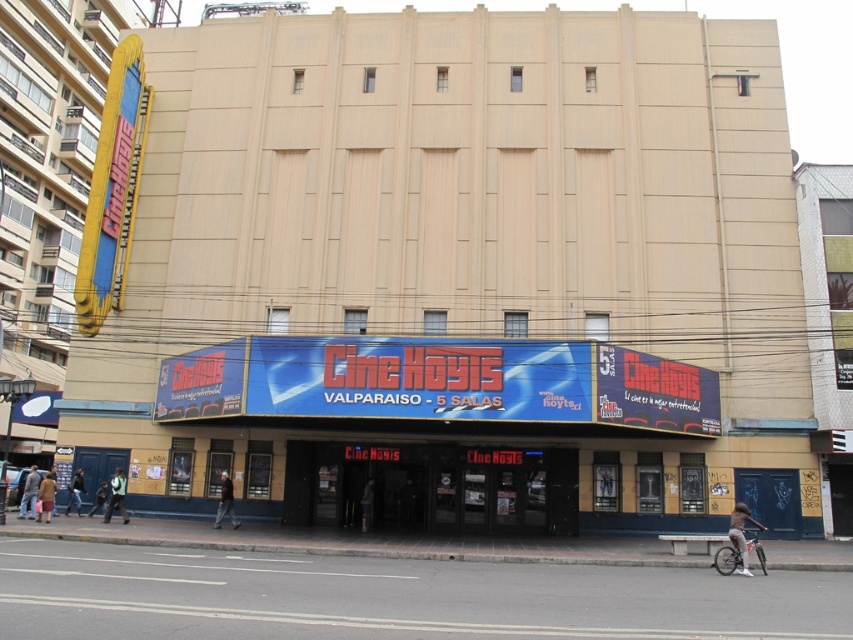
Question: Which object is closer to the camera taking this photo?

Choices:
 (A) dark gray fabric pants at center
 (B) light brown leather jacket at lower left
 (C) green fabric jacket at lower left
 (D) gray fabric jacket at lower right

Answer: (D)

Question: Does light brown leather jacket at lower left appear on the right side of dark brown leather jacket at lower left?

Choices:
 (A) yes
 (B) no

Answer: (B)

Question: Can you confirm if green fabric jacket at lower left is positioned to the right of dark brown leather jacket at lower left?

Choices:
 (A) no
 (B) yes

Answer: (B)

Question: Considering the real-world distances, which object is closest to the dark blue jeans at lower left?

Choices:
 (A) dark brown leather jacket at lower left
 (B) gray fabric jacket at lower right

Answer: (A)

Question: Which point appears farthest from the camera in this image?

Choices:
 (A) (370, 500)
 (B) (30, 483)

Answer: (A)

Question: Does gray fabric jacket at lower right come in front of dark blue jeans at lower left?

Choices:
 (A) yes
 (B) no

Answer: (A)